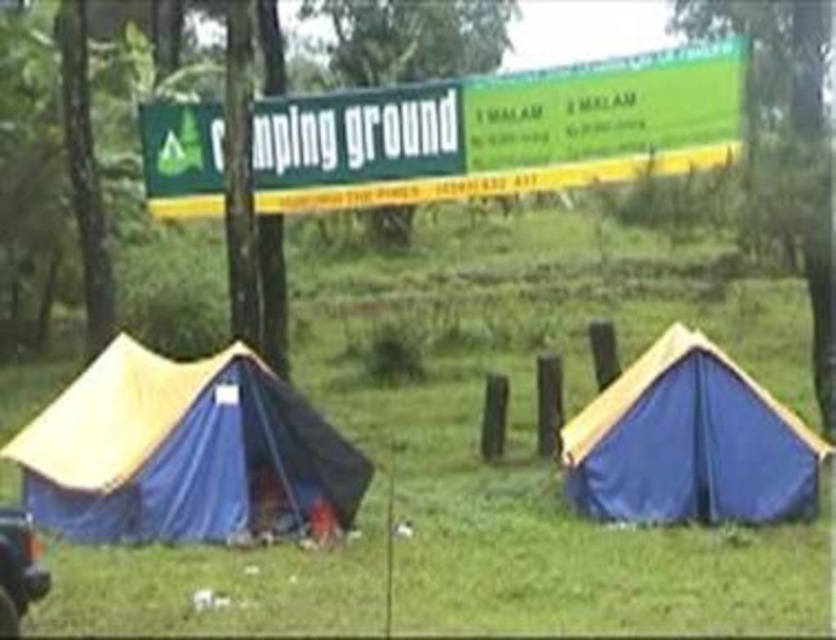
Question: Is green grass at center smaller than shiny black car at lower left?

Choices:
 (A) yes
 (B) no

Answer: (B)

Question: Does blue canvas tent at center appear on the left side of shiny black car at lower left?

Choices:
 (A) no
 (B) yes

Answer: (A)

Question: Which of the following is the closest to the observer?

Choices:
 (A) green grass at center
 (B) blue canvas tent at center
 (C) blue fabric tent at left
 (D) green plastic signboard at upper center

Answer: (A)

Question: Which point is farther to the camera?

Choices:
 (A) blue canvas tent at center
 (B) green grass at center
 (C) shiny black car at lower left

Answer: (A)

Question: Is green grass at center further to the viewer compared to shiny black car at lower left?

Choices:
 (A) yes
 (B) no

Answer: (A)

Question: Which point is farther from the camera taking this photo?

Choices:
 (A) (600, 109)
 (B) (622, 416)
 (C) (38, 580)

Answer: (A)